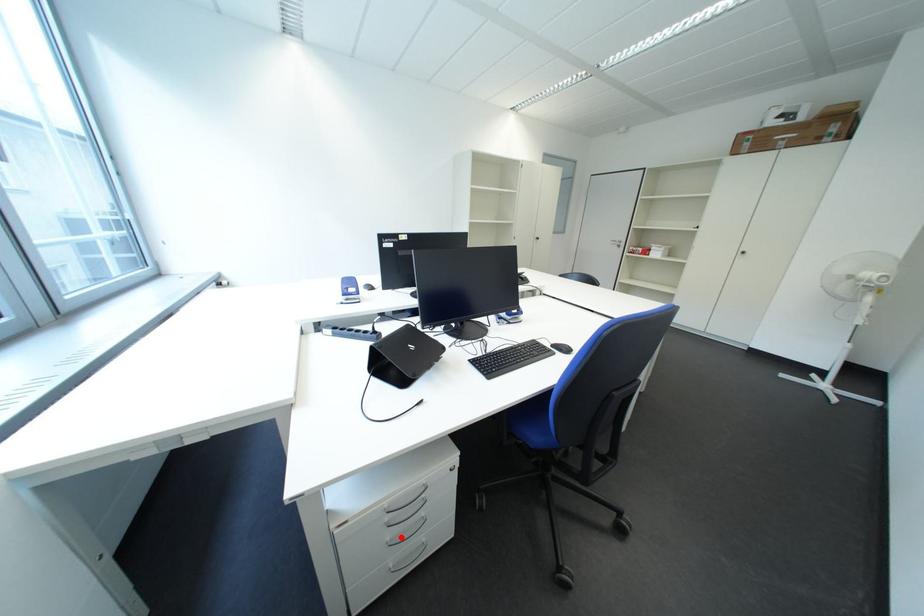
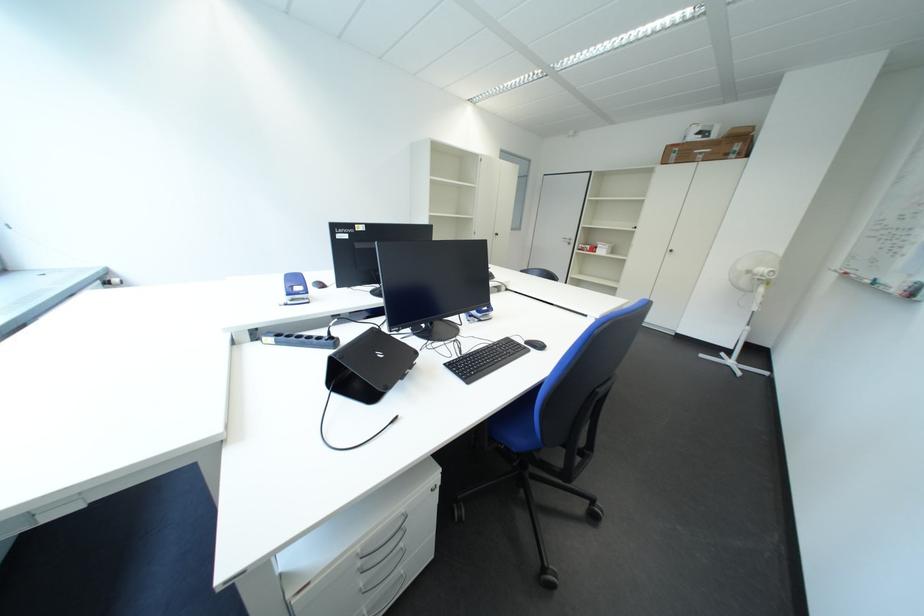
Question: I am providing you with two images of the same scene from different viewpoints. Image1 has a red point marked. In image2, the corresponding 3D location appears at what relative position? Reply with the corresponding letter.

Choices:
 (A) Closer
 (B) Farther

Answer: (A)